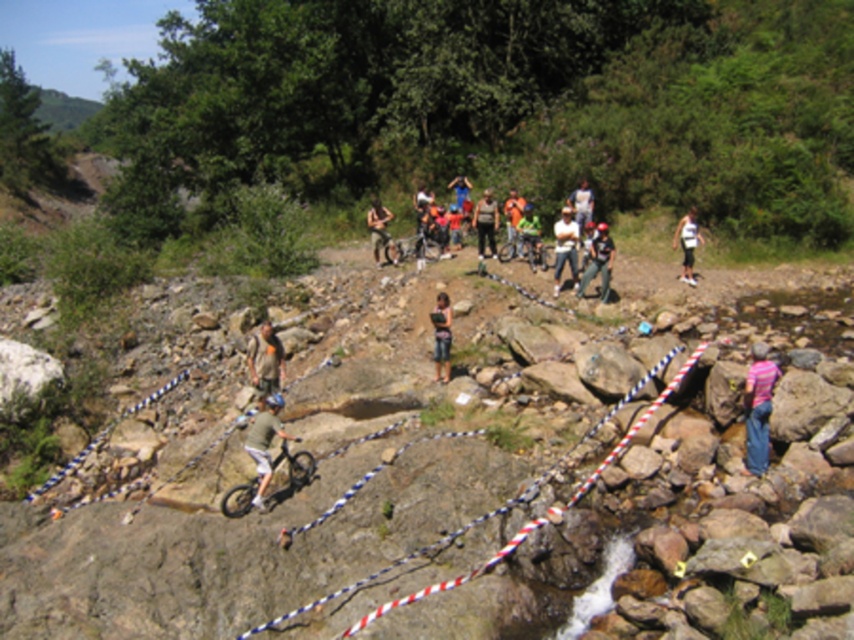
You are a photographer trying to capture the group of people in the rocky area. You notice a point marked at coordinates [264,442]. What object is located at this point?

The point at [264,442] is located on green fabric shorts at center.

You are a photographer at the mountain biking event and want to capture a photo of the pink striped shirt at lower right. According to the coordinates provided, where should you aim your camera?

The pink striped shirt at lower right is located at point (x=758, y=406), so you should aim your camera at that coordinate to capture it.

You are a photographer trying to capture a photo of the green fabric shorts at center while standing on the point marked at coordinates (264, 442). Will you be able to see the green fabric shorts at center from your current position?

Yes, because the photographer is standing at the point where the green fabric shorts at center is located, so they can see it directly.